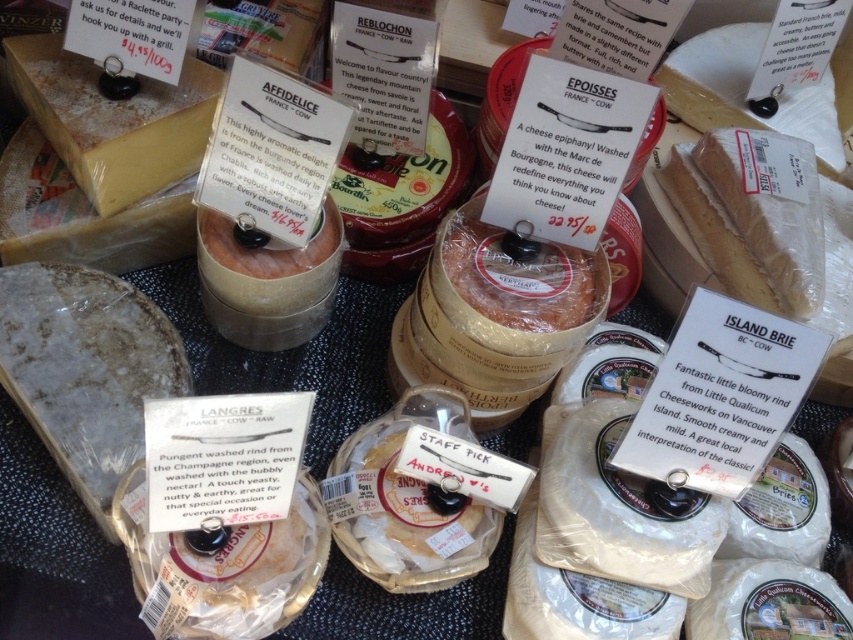
Find the location of a particular element. This screenshot has height=640, width=853. yellowish hard cheese at upper left is located at coordinates [114, 120].

Is yellowish hard cheese at upper left taller than white crumbly cheese at upper right?

No.

Is point (96, 77) less distant than point (671, 99)?

Yes, point (96, 77) is closer to viewer.

I want to click on yellowish hard cheese at upper left, so click(114, 120).